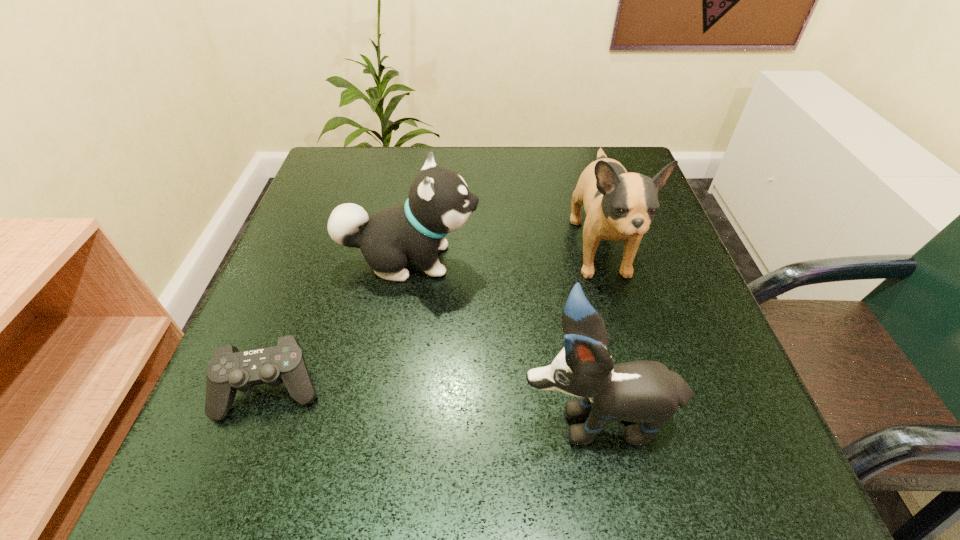
Image resolution: width=960 pixels, height=540 pixels. I want to click on control at the left edge, so click(x=229, y=370).

At what (x,y) coordinates should I click in order to perform the action: click on object that is at the near right corner. Please return your answer as a coordinate pair (x, y). Looking at the image, I should click on pos(646,392).

In the image, there is a desktop. At what (x,y) coordinates should I click in order to perform the action: click on vacant space at the far edge. Please return your answer as a coordinate pair (x, y). This screenshot has width=960, height=540. Looking at the image, I should click on [512, 163].

I want to click on vacant position at the near edge of the desktop, so click(x=320, y=448).

In the image, there is a desktop. Where is `blank space at the left edge`? This screenshot has width=960, height=540. blank space at the left edge is located at coordinates [x=328, y=242].

Identify the location of vacant region at the right edge. The width and height of the screenshot is (960, 540). (650, 241).

The width and height of the screenshot is (960, 540). In the image, there is a desktop. In order to click on vacant space at the far left corner in this screenshot , I will do `click(370, 165)`.

Where is `free space between the nearest puppy and the control`? free space between the nearest puppy and the control is located at coordinates (434, 403).

Image resolution: width=960 pixels, height=540 pixels. Find the location of `blank region between the leftmost puppy and the shortest object`. blank region between the leftmost puppy and the shortest object is located at coordinates (341, 324).

At what (x,y) coordinates should I click in order to perform the action: click on vacant area that lies between the leftmost puppy and the control. Please return your answer as a coordinate pair (x, y). Looking at the image, I should click on (341, 324).